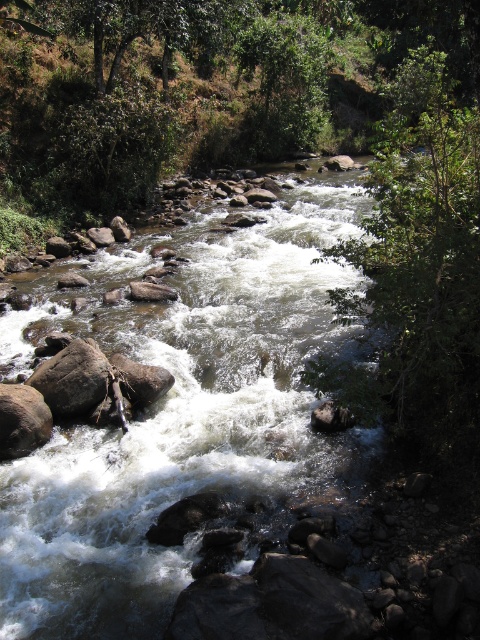
Question: Among these objects, which one is farthest from the camera?

Choices:
 (A) green leafy tree at upper center
 (B) brown rocky stream at center

Answer: (A)

Question: Is the position of brown rocky stream at center less distant than that of green leafy tree at upper right?

Choices:
 (A) no
 (B) yes

Answer: (A)

Question: Which of the following is the closest to the observer?

Choices:
 (A) green leafy tree at upper center
 (B) green leafy tree at upper right

Answer: (B)

Question: Can you confirm if green leafy tree at upper right is smaller than green leafy tree at upper center?

Choices:
 (A) yes
 (B) no

Answer: (B)

Question: From the image, what is the correct spatial relationship of brown rocky stream at center in relation to green leafy tree at upper center?

Choices:
 (A) right
 (B) left

Answer: (B)

Question: Considering the real-world distances, which object is closest to the green leafy tree at upper center?

Choices:
 (A) brown rocky stream at center
 (B) green leafy tree at upper right

Answer: (B)